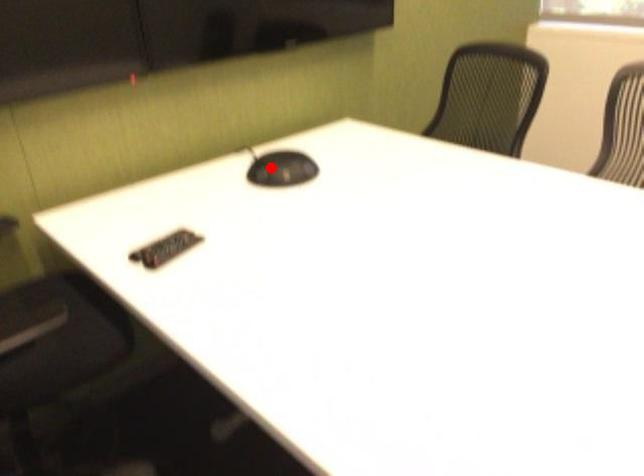
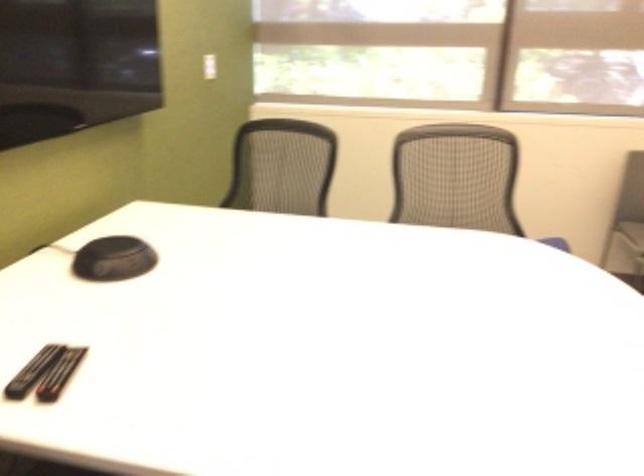
Question: I am providing you with two images of the same scene from different viewpoints. Image1 has a red point marked. In image2, the corresponding 3D location appears at what relative position? Reply with the corresponding letter.

Choices:
 (A) Closer
 (B) Farther

Answer: (A)